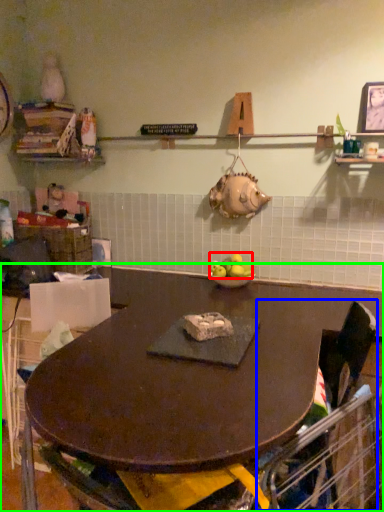
Question: Which is farther away from apple (highlighted by a red box)? swivel chair (highlighted by a blue box) or table (highlighted by a green box)?

Choices:
 (A) swivel chair
 (B) table

Answer: (A)